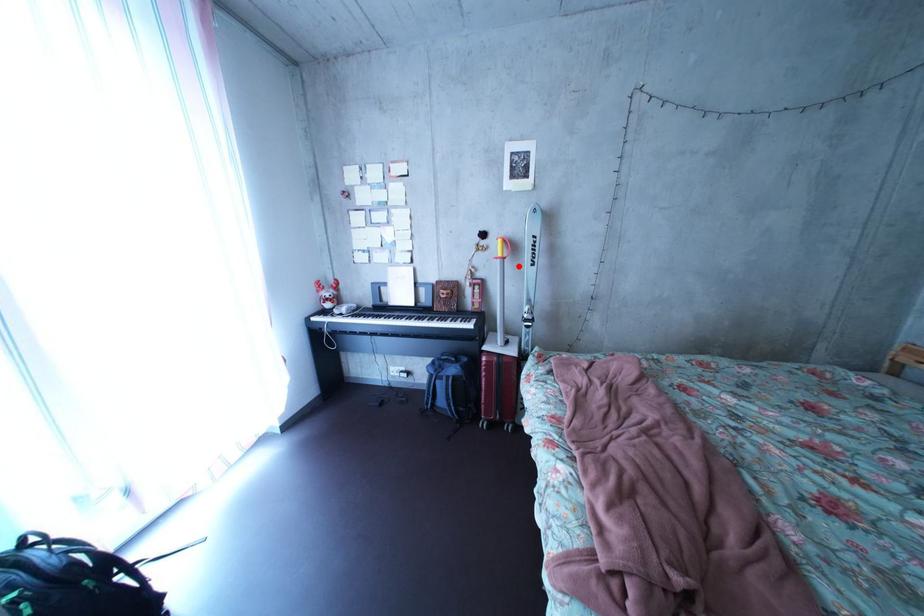
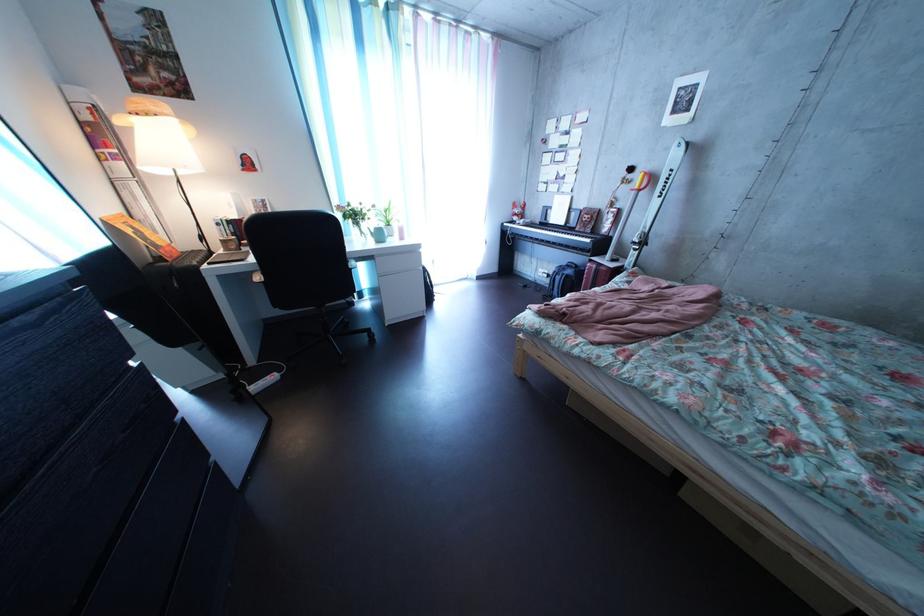
The point at the highlighted location is marked in the first image. Where is the corresponding point in the second image?

(653, 199)